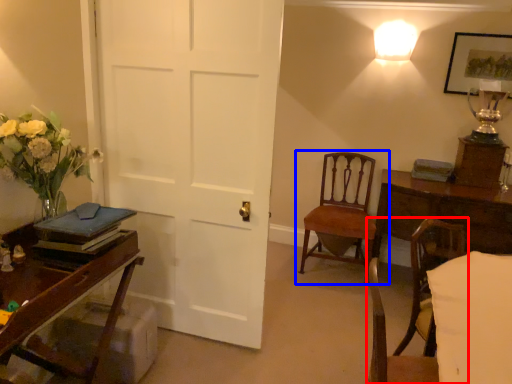
Question: Which object is closer to the camera taking this photo, chair (highlighted by a red box) or chair (highlighted by a blue box)?

Choices:
 (A) chair
 (B) chair

Answer: (A)